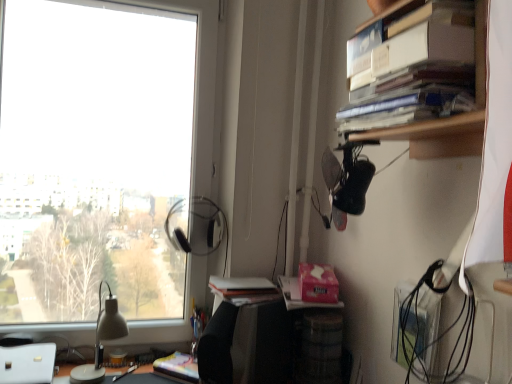
Question: Is matte white lamp at left located outside hardcover books at upper right?

Choices:
 (A) yes
 (B) no

Answer: (A)

Question: Is matte white lamp at left to the left of hardcover books at upper right from the viewer's perspective?

Choices:
 (A) no
 (B) yes

Answer: (B)

Question: Would you say hardcover books at upper right is part of matte white lamp at left's contents?

Choices:
 (A) no
 (B) yes

Answer: (A)

Question: Is matte white lamp at left far from hardcover books at upper right?

Choices:
 (A) yes
 (B) no

Answer: (A)

Question: Is matte white lamp at left wider than hardcover books at upper right?

Choices:
 (A) no
 (B) yes

Answer: (A)

Question: Is white matte book at center situated inside matte black desk at lower center or outside?

Choices:
 (A) inside
 (B) outside

Answer: (B)

Question: Based on their sizes in the image, would you say white matte book at center is bigger or smaller than matte black desk at lower center?

Choices:
 (A) big
 (B) small

Answer: (A)

Question: Would you say white matte book at center is to the left or to the right of matte black desk at lower center in the picture?

Choices:
 (A) left
 (B) right

Answer: (B)

Question: Is point [216, 296] positioned closer to the camera than point [123, 382]?

Choices:
 (A) closer
 (B) farther

Answer: (B)

Question: Is matte black desk at lower center in front of or behind multicolored paper at lower center in the image?

Choices:
 (A) behind
 (B) front

Answer: (B)

Question: Considering the positions of matte black desk at lower center and multicolored paper at lower center in the image, is matte black desk at lower center bigger or smaller than multicolored paper at lower center?

Choices:
 (A) small
 (B) big

Answer: (B)

Question: Do you think matte black desk at lower center is within multicolored paper at lower center, or outside of it?

Choices:
 (A) outside
 (B) inside

Answer: (A)

Question: Does point (153, 382) appear closer or farther from the camera than point (157, 367)?

Choices:
 (A) farther
 (B) closer

Answer: (B)

Question: Is point pyautogui.click(x=180, y=369) positioned closer to the camera than point pyautogui.click(x=109, y=324)?

Choices:
 (A) farther
 (B) closer

Answer: (A)

Question: In terms of size, does multicolored paper at lower center appear bigger or smaller than matte white lamp at left?

Choices:
 (A) small
 (B) big

Answer: (A)